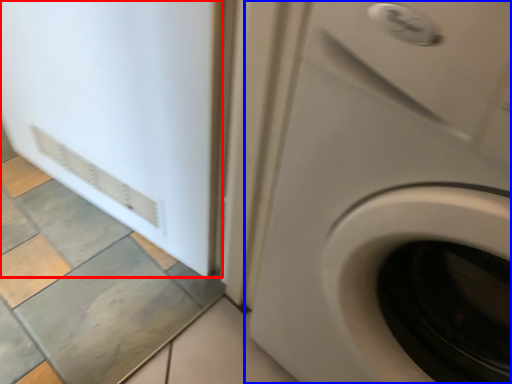
Question: Which object is closer to the camera taking this photo, screen door (highlighted by a red box) or washing machine (highlighted by a blue box)?

Choices:
 (A) screen door
 (B) washing machine

Answer: (B)